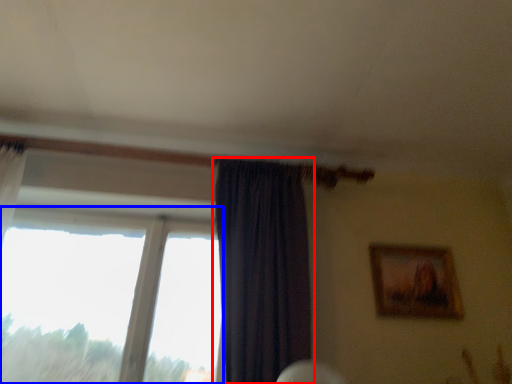
Question: Which point is further to the camera, curtain (highlighted by a red box) or window (highlighted by a blue box)?

Choices:
 (A) curtain
 (B) window

Answer: (B)